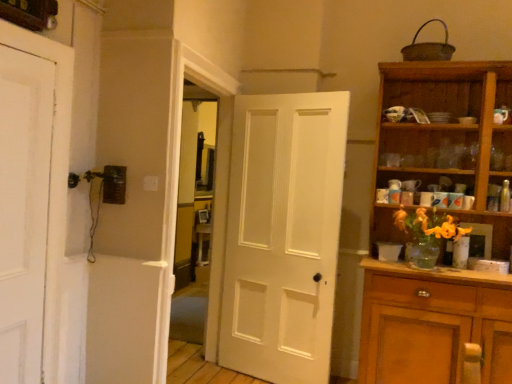
Question: From the image's perspective, would you say white matte door at left, the 1th door positioned from the front, is positioned over wooden cabinet at right?

Choices:
 (A) no
 (B) yes

Answer: (B)

Question: Is white matte door at left, which is counted as the 2th door, starting from the right, facing towards wooden cabinet at right?

Choices:
 (A) no
 (B) yes

Answer: (A)

Question: Is white matte door at left, which is counted as the 2th door, starting from the right, far from wooden cabinet at right?

Choices:
 (A) yes
 (B) no

Answer: (A)

Question: Is white matte door at left, the second door positioned from the back, closer to camera compared to wooden cabinet at right?

Choices:
 (A) no
 (B) yes

Answer: (B)

Question: Is white matte door at left, acting as the first door starting from the left, thinner than wooden cabinet at right?

Choices:
 (A) yes
 (B) no

Answer: (A)

Question: Does white matte door at left, which is counted as the 2th door, starting from the right, have a greater width compared to wooden cabinet at right?

Choices:
 (A) no
 (B) yes

Answer: (A)

Question: Is white matte door at center, which is the 1th door in right-to-left order, wider than white matte door at left, the second door positioned from the back?

Choices:
 (A) no
 (B) yes

Answer: (B)

Question: Is white matte door at center, the 1th door when ordered from back to front, positioned in front of white matte door at left, which is counted as the 2th door, starting from the right?

Choices:
 (A) yes
 (B) no

Answer: (B)

Question: Is white matte door at center, which is the 1th door in right-to-left order, at the left side of white matte door at left, the 1th door positioned from the front?

Choices:
 (A) yes
 (B) no

Answer: (B)

Question: Is white matte door at center, which is counted as the 2th door, starting from the front, smaller than white matte door at left, acting as the first door starting from the left?

Choices:
 (A) no
 (B) yes

Answer: (A)

Question: Is white matte door at center, which is the 1th door in right-to-left order, oriented towards white matte door at left, the 1th door positioned from the front?

Choices:
 (A) yes
 (B) no

Answer: (A)

Question: Considering the relative sizes of white matte door at center, which is counted as the 2th door, starting from the front, and white matte door at left, the 1th door positioned from the front, in the image provided, is white matte door at center, which is counted as the 2th door, starting from the front, bigger than white matte door at left, the 1th door positioned from the front,?

Choices:
 (A) yes
 (B) no

Answer: (A)

Question: Does wooden cabinet at right turn towards white matte door at left, the second door positioned from the back?

Choices:
 (A) yes
 (B) no

Answer: (B)